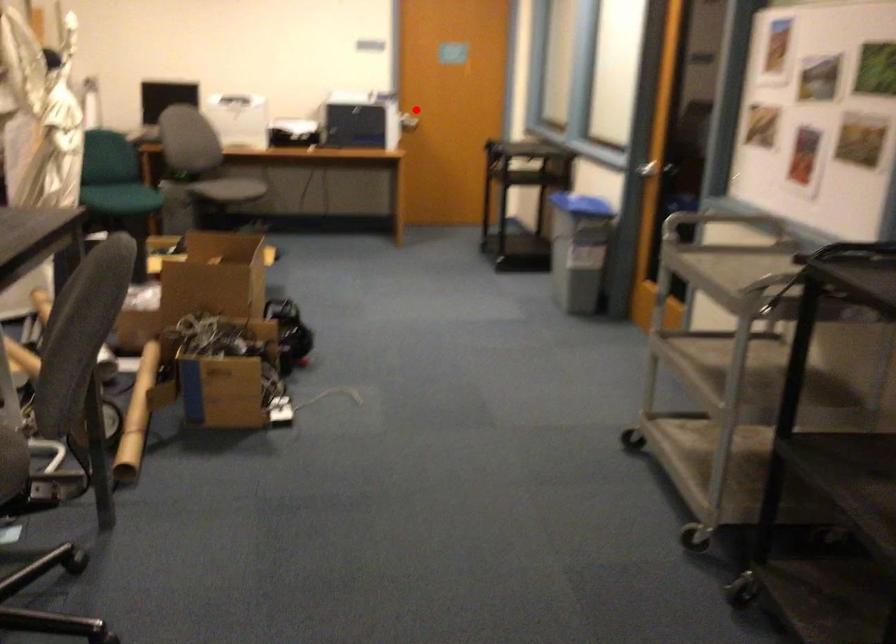
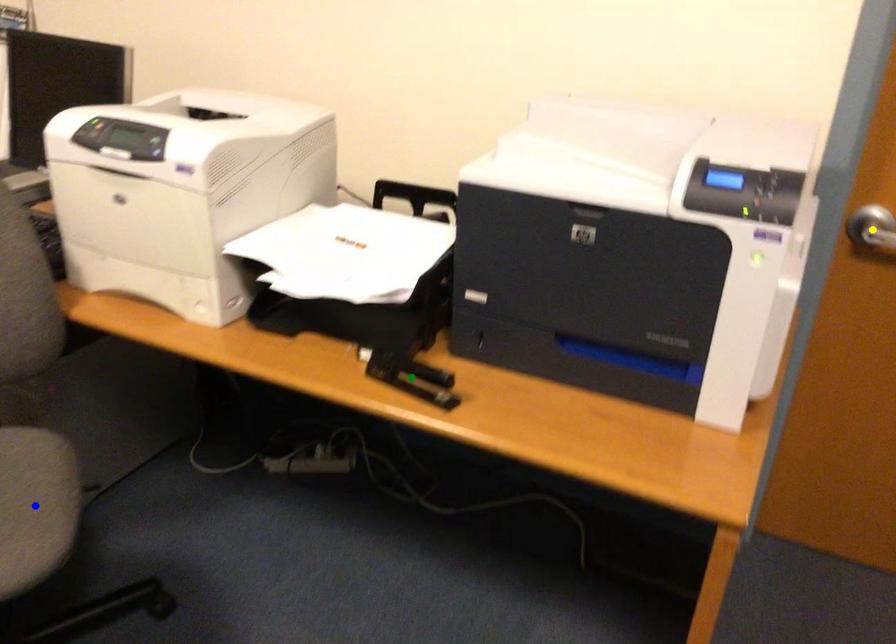
Question: I am providing you with two images of the same scene from different viewpoints. A red point is marked on the first image. You are given multiple points on the second image. Which spot in image 2 lines up with the point in image 1?

Choices:
 (A) blue point
 (B) yellow point
 (C) green point

Answer: (B)